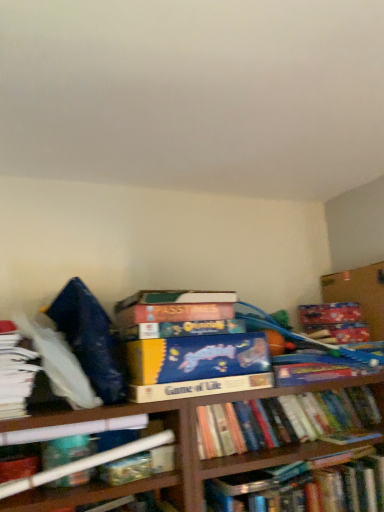
Question: Should I look upward or downward to see hardcover book at center, the first book positioned from the bottom?

Choices:
 (A) up
 (B) down

Answer: (B)

Question: Is cardboard box at upper right at the left side of white paper at left, positioned as the 4th book in bottom-to-top order?

Choices:
 (A) no
 (B) yes

Answer: (A)

Question: Is cardboard box at upper right behind white paper at left, positioned as the 4th book in bottom-to-top order?

Choices:
 (A) no
 (B) yes

Answer: (B)

Question: Is cardboard box at upper right outside of white paper at left, positioned as the 4th book in bottom-to-top order?

Choices:
 (A) yes
 (B) no

Answer: (A)

Question: Is cardboard box at upper right wider than white paper at left, positioned as the 4th book in bottom-to-top order?

Choices:
 (A) no
 (B) yes

Answer: (B)

Question: Can you confirm if cardboard box at upper right is thinner than white paper at left, positioned as the 4th book in bottom-to-top order?

Choices:
 (A) yes
 (B) no

Answer: (B)

Question: Considering the relative sizes of cardboard box at upper right and white paper at left, positioned as the 4th book in bottom-to-top order, in the image provided, is cardboard box at upper right bigger than white paper at left, positioned as the 4th book in bottom-to-top order,?

Choices:
 (A) yes
 (B) no

Answer: (A)

Question: Does cardboard box at upper right have a larger size compared to hardcover book at center, the first book positioned from the bottom?

Choices:
 (A) no
 (B) yes

Answer: (A)

Question: Is cardboard box at upper right oriented away from hardcover book at center, placed as the 4th book when sorted from top to bottom?

Choices:
 (A) yes
 (B) no

Answer: (B)

Question: Can you confirm if cardboard box at upper right is smaller than hardcover book at center, placed as the 4th book when sorted from top to bottom?

Choices:
 (A) no
 (B) yes

Answer: (B)

Question: Could you tell me if cardboard box at upper right is facing hardcover book at center, placed as the 4th book when sorted from top to bottom?

Choices:
 (A) no
 (B) yes

Answer: (A)

Question: From a real-world perspective, is cardboard box at upper right physically below hardcover book at center, the first book positioned from the bottom?

Choices:
 (A) yes
 (B) no

Answer: (B)

Question: Can you confirm if cardboard box at upper right is taller than hardcover book at center, the first book positioned from the bottom?

Choices:
 (A) no
 (B) yes

Answer: (B)

Question: From the image's perspective, is white paper at left, positioned as the 4th book in bottom-to-top order, beneath cardboard box at upper right?

Choices:
 (A) yes
 (B) no

Answer: (A)